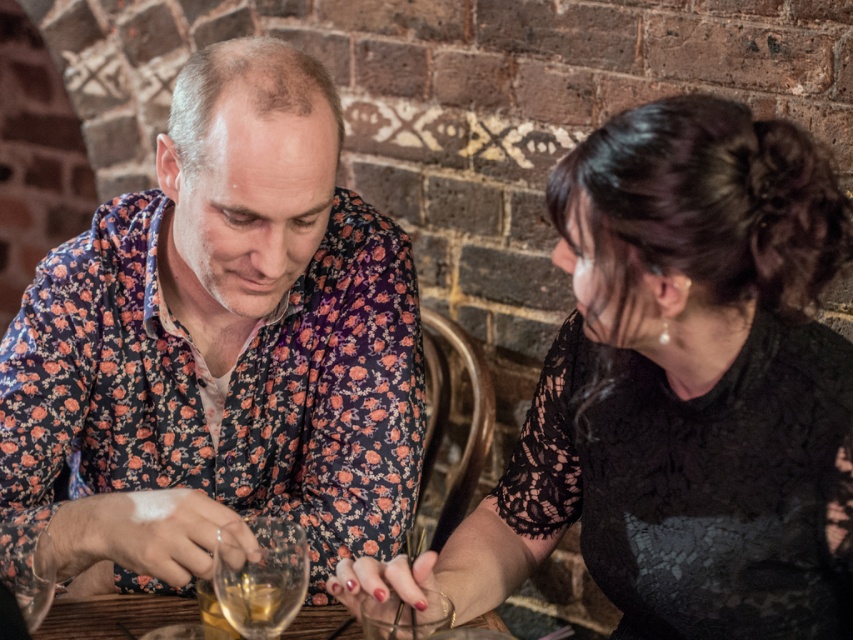
Consider the image. You are a photographer trying to capture a closeup of the clear glass at lower center without including the black lace dress at center in the frame. Is it possible to do so based on their positions?

The black lace dress at center might be wider than clear glass at lower center, so there is a possibility that the dress could block the view of the glass. To ensure the glass is visible without the dress, the photographer should adjust the angle or position to frame around the dress.